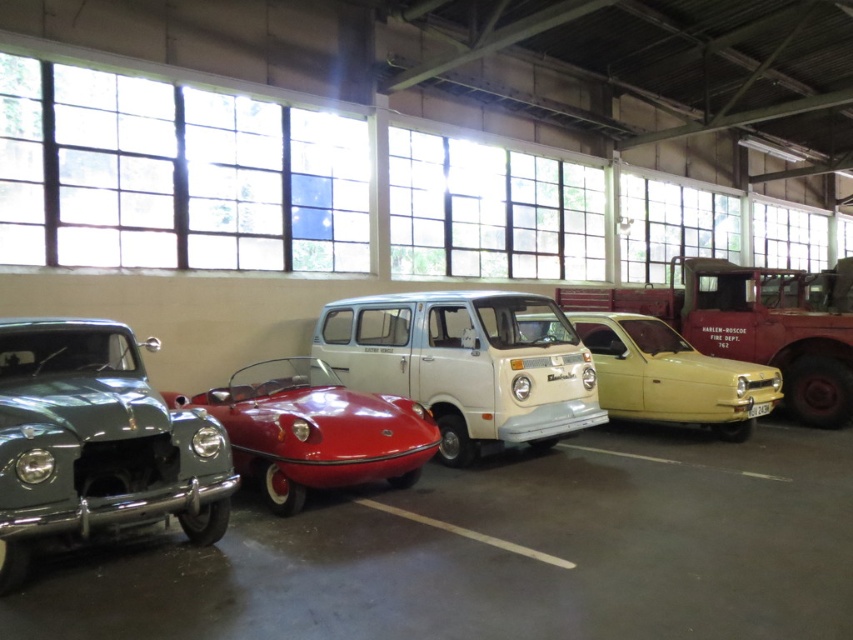
Who is higher up, shiny green car at left or yellow matte car at center?

yellow matte car at center

Who is positioned more to the right, shiny green car at left or yellow matte car at center?

yellow matte car at center

Where is `shiny green car at left`? shiny green car at left is located at coordinates (96, 444).

This screenshot has height=640, width=853. What are the coordinates of `shiny green car at left` in the screenshot? It's located at (96, 444).

Which of these two, shiny green car at left or red matte fire truck at right, stands shorter?

With less height is red matte fire truck at right.

Measure the distance between shiny green car at left and camera.

shiny green car at left is 3.98 meters away from camera.

Locate an element on the screen. shiny green car at left is located at coordinates (96, 444).

Who is higher up, shiny green car at left or shiny red car at center?

shiny green car at left is higher up.

Does shiny green car at left have a lesser width compared to shiny red car at center?

Yes.

Where is `shiny green car at left`? shiny green car at left is located at coordinates (96, 444).